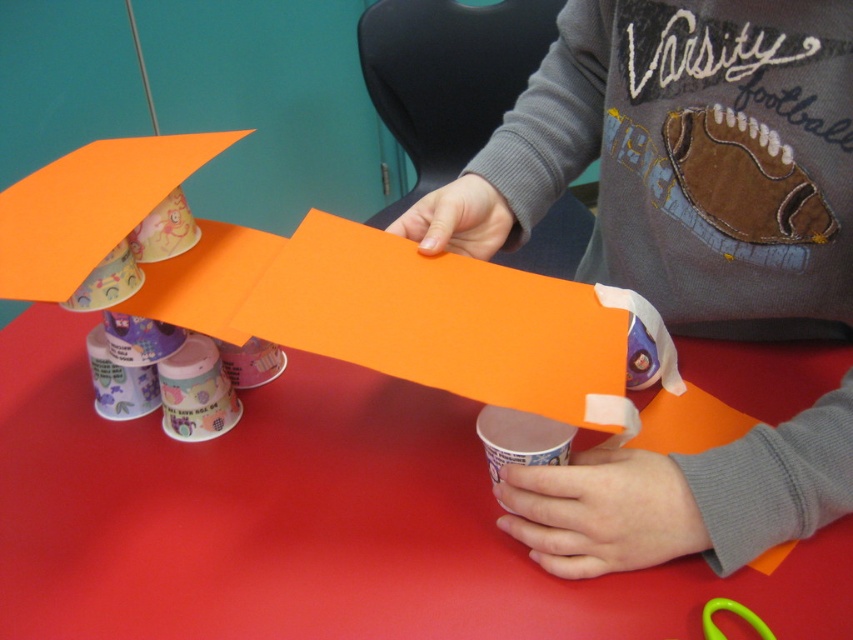
Between point (537, 420) and point (712, 604), which one is positioned behind?

Point (537, 420)

Is point (534, 433) positioned after point (717, 604)?

Yes, it is.

The height and width of the screenshot is (640, 853). I want to click on white paper cup at center, so click(x=521, y=438).

Does red paper table at center have a smaller size compared to green plastic scissors at lower right?

Incorrect, red paper table at center is not smaller in size than green plastic scissors at lower right.

The width and height of the screenshot is (853, 640). What do you see at coordinates (311, 522) in the screenshot?
I see `red paper table at center` at bounding box center [311, 522].

Is point (700, 604) positioned after point (703, 614)?

Yes, point (700, 604) is farther from viewer.

Identify the location of red paper table at center. This screenshot has height=640, width=853. (311, 522).

Is red paper table at center bigger than white paper cup at center?

Correct, red paper table at center is larger in size than white paper cup at center.

Who is more forward, (422, 570) or (518, 445)?

Point (422, 570) is more forward.

Find the location of a particular element. red paper table at center is located at coordinates (311, 522).